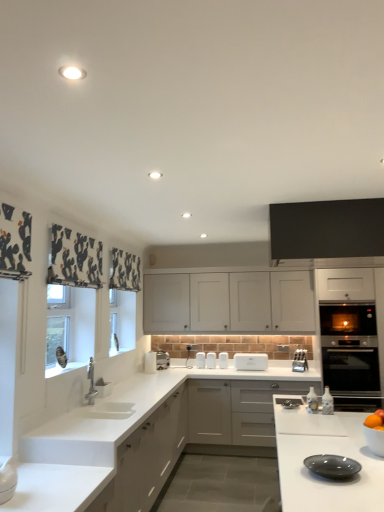
Image resolution: width=384 pixels, height=512 pixels. What do you see at coordinates (156, 361) in the screenshot?
I see `white glossy paper towel dispenser at upper center, the 1th appliance positioned from the left` at bounding box center [156, 361].

At what (x,y) coordinates should I click in order to perform the action: click on orange matte at right. Please return your answer as a coordinate pair (x, y). This screenshot has height=512, width=384. Looking at the image, I should click on (375, 420).

This screenshot has height=512, width=384. What do you see at coordinates (332, 466) in the screenshot?
I see `matte gray plate at lower right` at bounding box center [332, 466].

Describe the element at coordinates (300, 361) in the screenshot. I see `metallic silver knife block at lower right, the 2th appliance viewed from the left` at that location.

How much space does white glossy countertop at lower right, the 1th countertop viewed from the front, occupy vertically?

white glossy countertop at lower right, the 1th countertop viewed from the front, is 37.49 inches in height.

The width and height of the screenshot is (384, 512). What do you see at coordinates (236, 410) in the screenshot?
I see `white matte cabinet at center, marked as the third cabinetry in a top-to-bottom arrangement` at bounding box center [236, 410].

The height and width of the screenshot is (512, 384). Describe the element at coordinates (327, 229) in the screenshot. I see `black matte cabinet at upper center, which is the third cabinetry in bottom-to-top order` at that location.

The image size is (384, 512). Find the location of `white glossy paper towel dispenser at upper center, the 2th appliance positioned from the right`. white glossy paper towel dispenser at upper center, the 2th appliance positioned from the right is located at coordinates (156, 361).

How distant is matte gray plate at lower right from white glossy countertop at lower right, placed as the 2th countertop when sorted from back to front?

The distance of matte gray plate at lower right from white glossy countertop at lower right, placed as the 2th countertop when sorted from back to front, is 8.65 inches.

The width and height of the screenshot is (384, 512). There is a matte gray plate at lower right. Identify the location of the 1st countertop below it (from the image's perspective). (325, 453).

Considering the relative sizes of matte gray plate at lower right and white glossy countertop at lower right, placed as the 2th countertop when sorted from back to front, in the image provided, is matte gray plate at lower right smaller than white glossy countertop at lower right, placed as the 2th countertop when sorted from back to front,?

Correct, matte gray plate at lower right occupies less space than white glossy countertop at lower right, placed as the 2th countertop when sorted from back to front.

From the white glossy countertop at lower right, placed as the 2th countertop when sorted from back to front, count 2nd cabinetrys backward and point to it. Please provide its 2D coordinates.

[(236, 410)]

Does white glossy countertop at lower right, placed as the 2th countertop when sorted from back to front, come in front of white matte cabinet at center, the 2th cabinetry when ordered from front to back?

Yes, it is in front of white matte cabinet at center, the 2th cabinetry when ordered from front to back.

Looking at this image, is white matte cabinet at center, the second cabinetry from the back, inside white glossy countertop at lower right, the 1th countertop viewed from the front?

That's incorrect, white matte cabinet at center, the second cabinetry from the back, is not inside white glossy countertop at lower right, the 1th countertop viewed from the front.

From a real-world perspective, does white glossy countertop at lower right, placed as the 2th countertop when sorted from back to front, sit lower than white matte cabinet at center, the 2th cabinetry when ordered from front to back?

Correct, in the physical world, white glossy countertop at lower right, placed as the 2th countertop when sorted from back to front, is lower than white matte cabinet at center, the 2th cabinetry when ordered from front to back.

Who is more distant, matte gray plate at lower right or white matte cabinet at center, which appears as the second cabinetry when viewed from the top?

white matte cabinet at center, which appears as the second cabinetry when viewed from the top, is behind.

Based on the photo, from the image's perspective, is matte gray plate at lower right located above white matte cabinet at center, the first cabinetry from the back?

No, from the image's perspective, matte gray plate at lower right is not above white matte cabinet at center, the first cabinetry from the back.

Considering the relative sizes of matte gray plate at lower right and white matte cabinet at center, which is the second cabinetry from bottom to top, in the image provided, is matte gray plate at lower right thinner than white matte cabinet at center, which is the second cabinetry from bottom to top,?

Indeed, matte gray plate at lower right has a lesser width compared to white matte cabinet at center, which is the second cabinetry from bottom to top.

Is point (345, 457) less distant than point (312, 317)?

Yes, it is.

Is the surface of black matte cabinet at upper center, which ranks as the first cabinetry in top-to-bottom order, in direct contact with white glossy paper towel dispenser at upper center, the 2th appliance positioned from the right?

black matte cabinet at upper center, which ranks as the first cabinetry in top-to-bottom order, and white glossy paper towel dispenser at upper center, the 2th appliance positioned from the right, are clearly separated.

Which is behind, point (328, 202) or point (155, 357)?

The point (155, 357) is farther.

Is black matte cabinet at upper center, which is the third cabinetry from back to front, to the right of white glossy paper towel dispenser at upper center, the 1th appliance positioned from the left, from the viewer's perspective?

Yes, black matte cabinet at upper center, which is the third cabinetry from back to front, is to the right of white glossy paper towel dispenser at upper center, the 1th appliance positioned from the left.

Is white matte countertop at lower left, marked as the 1th countertop in a back-to-front arrangement, to the left or to the right of black glass oven at right, acting as the first oven starting from the top, in the image?

Clearly, white matte countertop at lower left, marked as the 1th countertop in a back-to-front arrangement, is on the left of black glass oven at right, acting as the first oven starting from the top, in the image.

Considering their positions, is white matte countertop at lower left, marked as the second countertop in a front-to-back arrangement, located in front of or behind black glass oven at right, the 2th oven ordered from the bottom?

white matte countertop at lower left, marked as the second countertop in a front-to-back arrangement, is positioned closer to the viewer than black glass oven at right, the 2th oven ordered from the bottom.

Do you think white matte countertop at lower left, marked as the 1th countertop in a back-to-front arrangement, is within black glass oven at right, acting as the first oven starting from the top, or outside of it?

white matte countertop at lower left, marked as the 1th countertop in a back-to-front arrangement, is outside black glass oven at right, acting as the first oven starting from the top.

Does white matte countertop at lower left, marked as the second countertop in a front-to-back arrangement, have a greater height compared to black glass oven at right, the 2th oven ordered from the bottom?

Incorrect, the height of white matte countertop at lower left, marked as the second countertop in a front-to-back arrangement, is not larger of that of black glass oven at right, the 2th oven ordered from the bottom.

From the picture: Does black stainless steel oven at right, which is counted as the second oven, starting from the top, touch white glossy paper towel dispenser at upper center, the 1th appliance positioned from the left?

black stainless steel oven at right, which is counted as the second oven, starting from the top, and white glossy paper towel dispenser at upper center, the 1th appliance positioned from the left, are not in contact.

From a real-world perspective, is black stainless steel oven at right, which is the first oven from bottom to top, over white glossy paper towel dispenser at upper center, the 2th appliance positioned from the right?

No, from a real-world perspective, black stainless steel oven at right, which is the first oven from bottom to top, is not above white glossy paper towel dispenser at upper center, the 2th appliance positioned from the right.

From the image's perspective, which is above, black stainless steel oven at right, which is counted as the second oven, starting from the top, or white glossy paper towel dispenser at upper center, the 1th appliance positioned from the left?

white glossy paper towel dispenser at upper center, the 1th appliance positioned from the left.

Are white glossy countertop at lower right, placed as the 2th countertop when sorted from back to front, and white matte countertop at lower left, marked as the 1th countertop in a back-to-front arrangement, located far from each other?

Yes, white glossy countertop at lower right, placed as the 2th countertop when sorted from back to front, is far from white matte countertop at lower left, marked as the 1th countertop in a back-to-front arrangement.

From a real-world perspective, between white glossy countertop at lower right, placed as the 2th countertop when sorted from back to front, and white matte countertop at lower left, marked as the 1th countertop in a back-to-front arrangement, who is vertically lower?

white glossy countertop at lower right, placed as the 2th countertop when sorted from back to front, from a real-world perspective.

Considering the relative positions of white glossy countertop at lower right, the 1th countertop viewed from the front, and white matte countertop at lower left, marked as the second countertop in a front-to-back arrangement, in the image provided, is white glossy countertop at lower right, the 1th countertop viewed from the front, to the left or to the right of white matte countertop at lower left, marked as the second countertop in a front-to-back arrangement,?

Based on their positions, white glossy countertop at lower right, the 1th countertop viewed from the front, is located to the right of white matte countertop at lower left, marked as the second countertop in a front-to-back arrangement.

Locate an element on the screen. Image resolution: width=384 pixels, height=512 pixels. kitchen appliance above the white glossy countertop at lower right, the 1th countertop viewed from the front (from the image's perspective) is located at coordinates (332, 466).

At what (x,y) coordinates should I click in order to perform the action: click on countertop on the right of white matte cabinet at center, marked as the third cabinetry in a top-to-bottom arrangement. Please return your answer as a coordinate pair (x, y). Looking at the image, I should click on 325,453.

Which object lies further to the anchor point orange matte at right, black glass oven at right, acting as the first oven starting from the top, or white glossy countertop at lower right, the 1th countertop viewed from the front?

black glass oven at right, acting as the first oven starting from the top, is further to orange matte at right.

Considering their positions, is white glossy paper towel dispenser at upper center, the 1th appliance positioned from the left, positioned further to white plastic toaster at center than white matte cabinet at center, the first cabinetry from the back?

Based on the image, white glossy paper towel dispenser at upper center, the 1th appliance positioned from the left, appears to be further to white plastic toaster at center.

Which object lies further to the anchor point white matte cabinet at center, the 2th cabinetry when ordered from front to back, white matte countertop at lower left, marked as the 1th countertop in a back-to-front arrangement, or matte gray plate at lower right?

Among the two, matte gray plate at lower right is located further to white matte cabinet at center, the 2th cabinetry when ordered from front to back.

When comparing their distances from black stainless steel oven at right, which is counted as the second oven, starting from the top, does white glossy countertop at lower right, placed as the 2th countertop when sorted from back to front, or black matte cabinet at upper center, which is the third cabinetry in bottom-to-top order, seem closer?

black matte cabinet at upper center, which is the third cabinetry in bottom-to-top order, lies closer to black stainless steel oven at right, which is counted as the second oven, starting from the top, than the other object.

Looking at the image, which one is located further to black stainless steel oven at right, which is the first oven from bottom to top, white glossy paper towel dispenser at upper center, the 2th appliance positioned from the right, or metallic silver knife block at lower right, the 2th appliance viewed from the left?

Among the two, white glossy paper towel dispenser at upper center, the 2th appliance positioned from the right, is located further to black stainless steel oven at right, which is the first oven from bottom to top.

When comparing their distances from metallic silver knife block at lower right, arranged as the first appliance when viewed from the right, does orange matte at right or white matte countertop at lower left, marked as the 1th countertop in a back-to-front arrangement, seem closer?

Based on the image, white matte countertop at lower left, marked as the 1th countertop in a back-to-front arrangement, appears to be nearer to metallic silver knife block at lower right, arranged as the first appliance when viewed from the right.

From the image, which object appears to be farther from matte gray plate at lower right, white glossy paper towel dispenser at upper center, the 1th appliance positioned from the left, or white plastic toaster at center?

The object further to matte gray plate at lower right is white glossy paper towel dispenser at upper center, the 1th appliance positioned from the left.

Which object lies nearer to the anchor point white matte cabinet at center, which is the second cabinetry from bottom to top, matte gray plate at lower right or metallic silver knife block at lower right, the 2th appliance viewed from the left?

The object closer to white matte cabinet at center, which is the second cabinetry from bottom to top, is metallic silver knife block at lower right, the 2th appliance viewed from the left.

What are the coordinates of `countertop between matte gray plate at lower right and white glossy paper towel dispenser at upper center, the 2th appliance positioned from the right, from front to back` in the screenshot? It's located at (143, 435).

Identify the location of orange located between white glossy countertop at lower right, the 1th countertop viewed from the front, and white glossy paper towel dispenser at upper center, the 1th appliance positioned from the left, in the depth direction. This screenshot has width=384, height=512. (375, 420).

You are a GUI agent. You are given a task and a screenshot of the screen. Output one action in this format:
    pyautogui.click(x=<x>, y=<y>)
    Task: Click on the cabinetry between matte gray plate at lower right and black stainless steel oven at right, which is counted as the second oven, starting from the top, in the front-back direction
    This screenshot has height=512, width=384.
    Given the screenshot: What is the action you would take?
    pyautogui.click(x=327, y=229)

At what (x,y) coordinates should I click in order to perform the action: click on orange between white glossy countertop at lower right, placed as the 2th countertop when sorted from back to front, and black glass oven at right, the 2th oven ordered from the bottom, in the front-back direction. Please return your answer as a coordinate pair (x, y). Looking at the image, I should click on (375, 420).